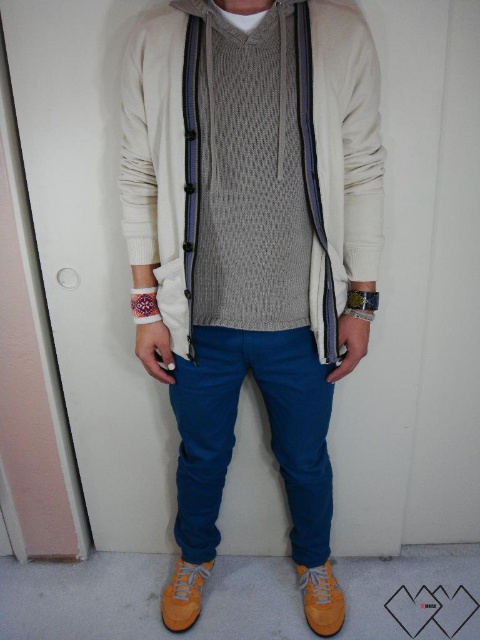
Question: Does knitted gray vest at center have a greater width compared to yellow suede shoe at lower center?

Choices:
 (A) yes
 (B) no

Answer: (A)

Question: Does suede shoes at lower center appear on the left side of yellow suede shoe at lower center?

Choices:
 (A) yes
 (B) no

Answer: (A)

Question: Which point appears closest to the camera in this image?

Choices:
 (A) (308, 602)
 (B) (282, 476)

Answer: (B)

Question: In this image, where is suede shoes at lower center located relative to orange suede shoe at lower center?

Choices:
 (A) below
 (B) above

Answer: (B)

Question: Estimate the real-world distances between objects in this image. Which object is farther from the knitted gray vest at center?

Choices:
 (A) yellow suede shoe at lower center
 (B) suede shoes at lower center

Answer: (A)

Question: Which object appears closest to the camera in this image?

Choices:
 (A) orange suede shoe at lower center
 (B) knitted gray vest at center
 (C) suede shoes at lower center

Answer: (C)